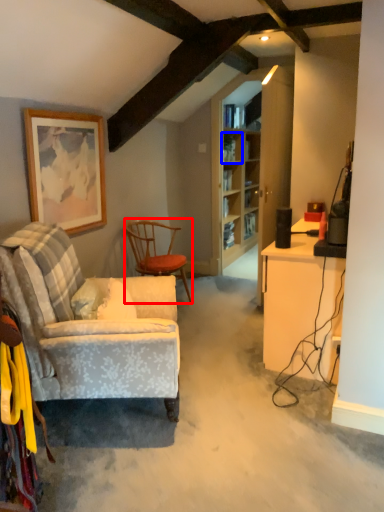
Question: Among these objects, which one is farthest to the camera, chair (highlighted by a red box) or shelf (highlighted by a blue box)?

Choices:
 (A) chair
 (B) shelf

Answer: (B)